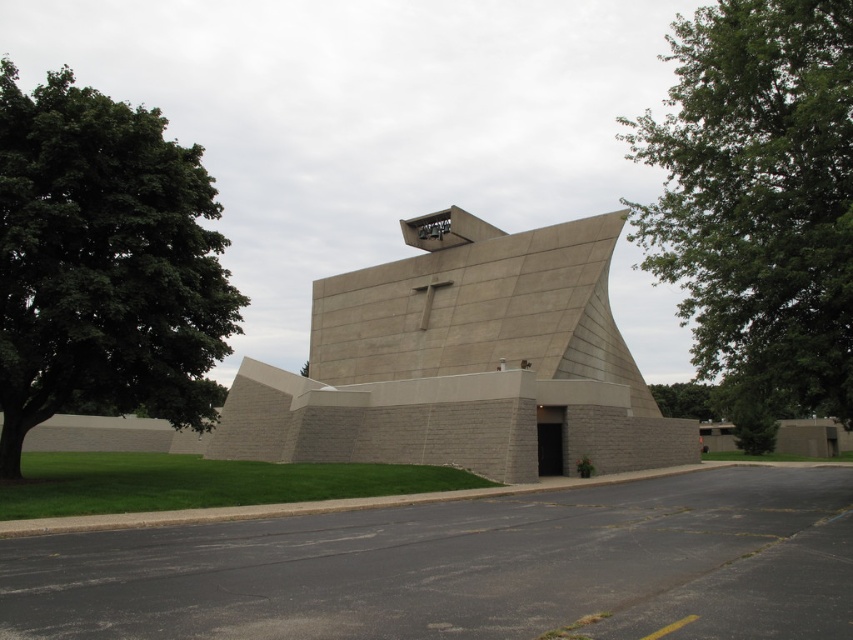
Question: Which of the following is the closest to the observer?

Choices:
 (A) gray concrete church at center
 (B) green leafy tree at left
 (C) green leafy tree at upper right
 (D) green leafy tree at lower right

Answer: (C)

Question: Which of the following is the farthest from the observer?

Choices:
 (A) [x=671, y=397]
 (B) [x=601, y=284]
 (C) [x=128, y=124]

Answer: (A)

Question: Is green leafy tree at upper right below green leafy tree at left?

Choices:
 (A) no
 (B) yes

Answer: (A)

Question: Considering the relative positions of gray concrete church at center and green leafy tree at lower right in the image provided, where is gray concrete church at center located with respect to green leafy tree at lower right?

Choices:
 (A) left
 (B) right

Answer: (A)

Question: Among these points, which one is nearest to the camera?

Choices:
 (A) (683, 387)
 (B) (822, 243)
 (C) (106, 225)

Answer: (B)

Question: Does green leafy tree at upper right have a greater width compared to green leafy tree at left?

Choices:
 (A) yes
 (B) no

Answer: (B)